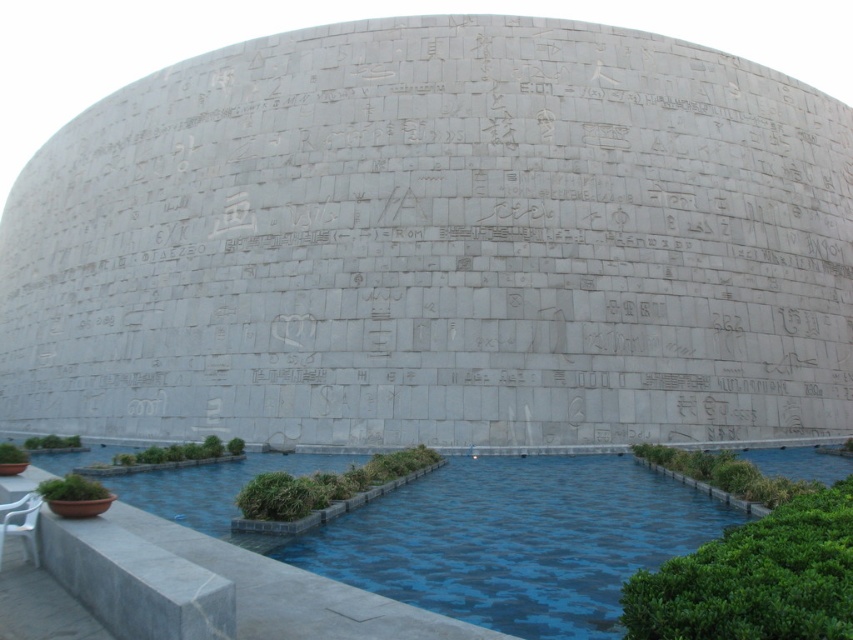
You are standing in front of the curved stone wall with carvings and the rectangular pool. There are two points marked on the image at coordinates point (299, 556) and point (33, 547). Which of these points is closer to you?

Point (33, 547) is closer to you because it is nearer to the camera compared to point (299, 556), which is further away.

You are standing in front of the curved gray stone wall with carvings. You see a blue concrete pool at lower center and a white plastic chair at lower left. Which object is closer to the wall?

The blue concrete pool at lower center is closer to the wall because it is located below the white plastic chair at lower left, placing it nearer to the wall compared to the chair.